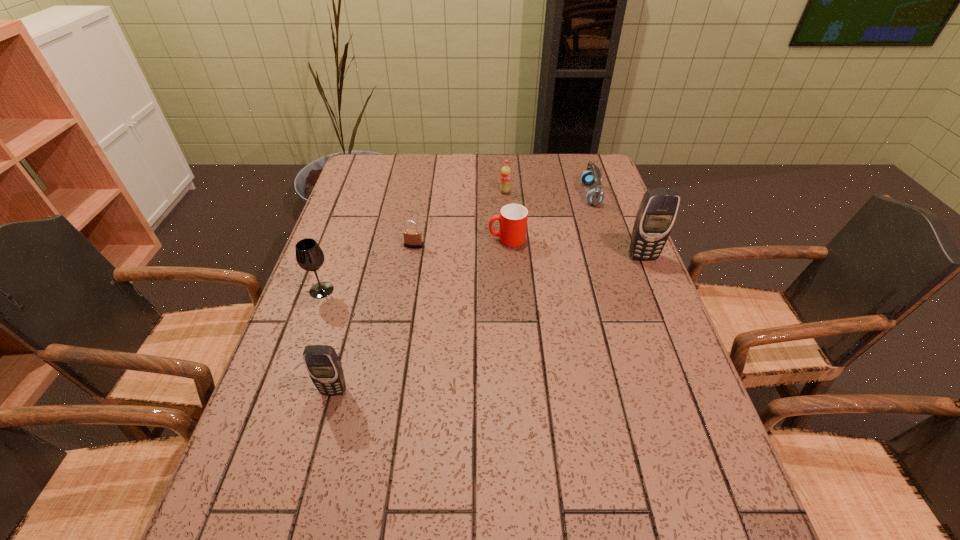
Locate an element on the screen. The height and width of the screenshot is (540, 960). free space located on the back of the third object from left to right is located at coordinates (421, 202).

I want to click on object situated at the far edge, so click(592, 175).

I want to click on cellular telephone at the left edge, so click(322, 362).

This screenshot has height=540, width=960. Identify the location of wineglass located at the left edge. (309, 255).

This screenshot has width=960, height=540. What are the coordinates of `cellular telephone situated at the right edge` in the screenshot? It's located at (657, 212).

Find the location of a particular element. The image size is (960, 540). headset at the right edge is located at coordinates (592, 175).

Find the location of a particular element. object located at the far right corner is located at coordinates (592, 175).

Where is `vacant space at the far edge of the desktop`? Image resolution: width=960 pixels, height=540 pixels. vacant space at the far edge of the desktop is located at coordinates (472, 183).

Image resolution: width=960 pixels, height=540 pixels. Find the location of `free space at the near edge of the desktop`. free space at the near edge of the desktop is located at coordinates (565, 488).

In the image, there is a desktop. Where is `vacant space at the left edge`? vacant space at the left edge is located at coordinates (308, 326).